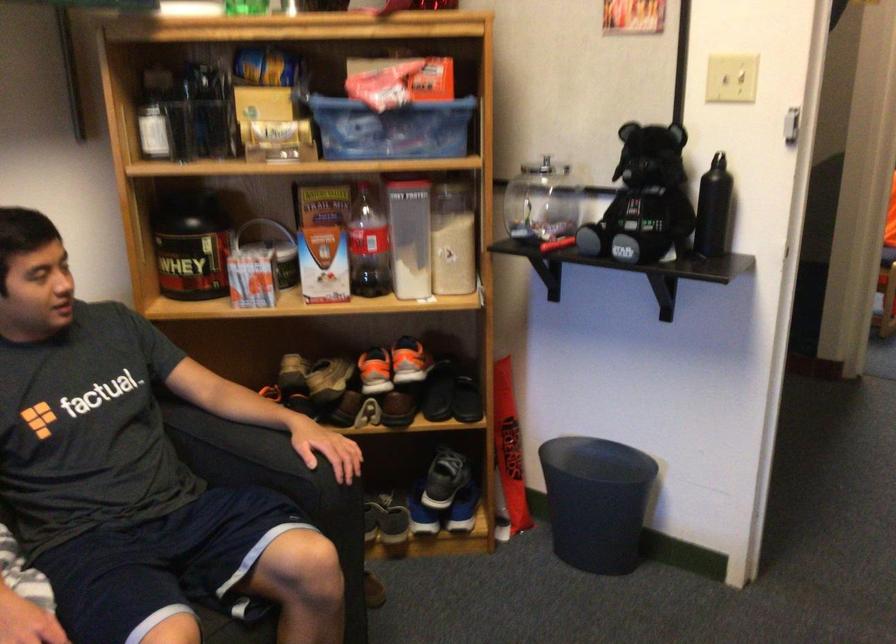
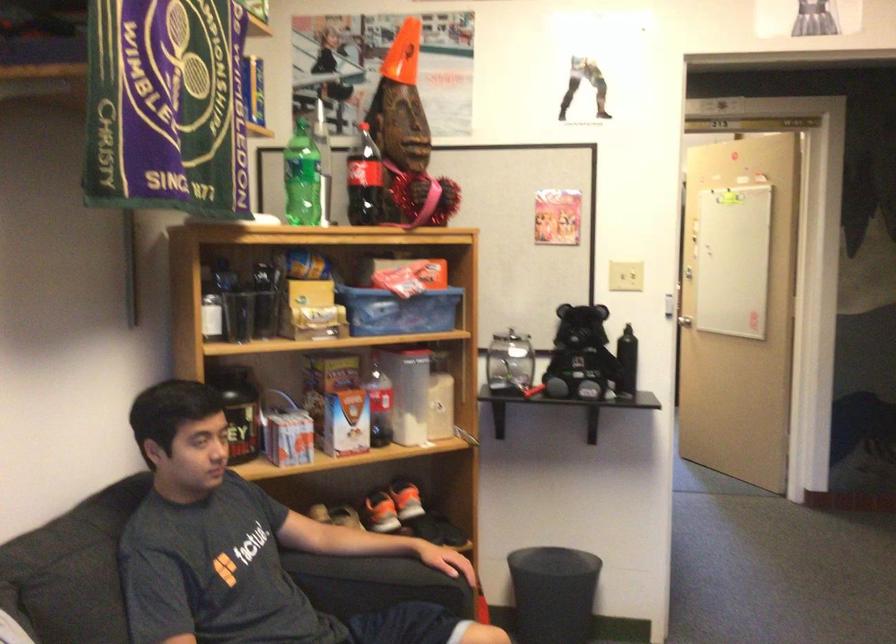
Question: In a continuous first-person perspective shot, in which direction is the camera moving?

Choices:
 (A) Left
 (B) Right
 (C) Forward
 (D) Backward

Answer: (A)